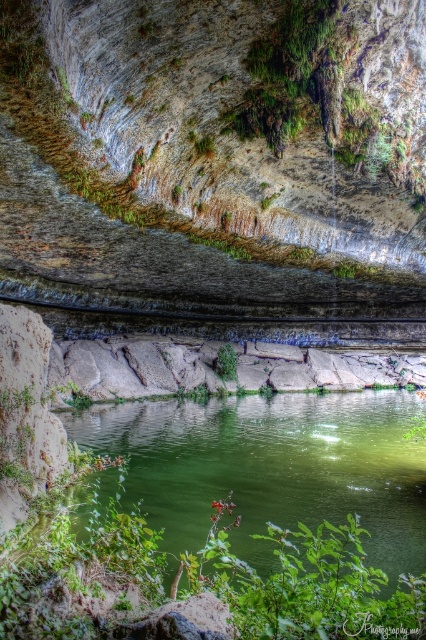
Question: Is green mossy rock at upper center thinner than green leafy plant at center?

Choices:
 (A) yes
 (B) no

Answer: (B)

Question: Which point is farther to the camera?

Choices:
 (A) green leafy plant at center
 (B) green smooth water at center
 (C) green mossy rock at upper center

Answer: (A)

Question: Among these objects, which one is farthest from the camera?

Choices:
 (A) green smooth water at center
 (B) green leafy plant at center

Answer: (B)

Question: Among these points, which one is nearest to the camera?

Choices:
 (A) (233, 371)
 (B) (75, 433)
 (C) (331, 81)

Answer: (C)

Question: Can you confirm if green smooth water at center is positioned to the right of green mossy rock at upper center?

Choices:
 (A) no
 (B) yes

Answer: (B)

Question: Does green mossy rock at upper center have a larger size compared to green leafy plant at center?

Choices:
 (A) yes
 (B) no

Answer: (A)